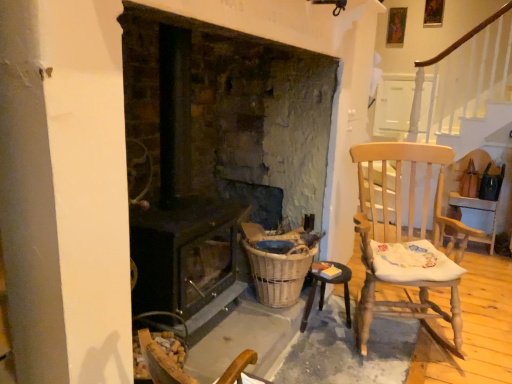
Question: In terms of height, does light wood rocking chair at right look taller or shorter compared to dark brown wood stove at center?

Choices:
 (A) tall
 (B) short

Answer: (B)

Question: Based on their positions, is light wood rocking chair at right located to the left or right of dark brown wood stove at center?

Choices:
 (A) left
 (B) right

Answer: (B)

Question: Estimate the real-world distances between objects in this image. Which object is closer to the woven brown basket at lower center?

Choices:
 (A) wooden table at lower right
 (B) light wood rocking chair at right
 (C) dark brown wood stove at center

Answer: (A)

Question: Which of these objects is positioned closest to the dark brown wood stove at center?

Choices:
 (A) wooden table at lower right
 (B) woven brown basket at lower center
 (C) light wood rocking chair at right

Answer: (B)